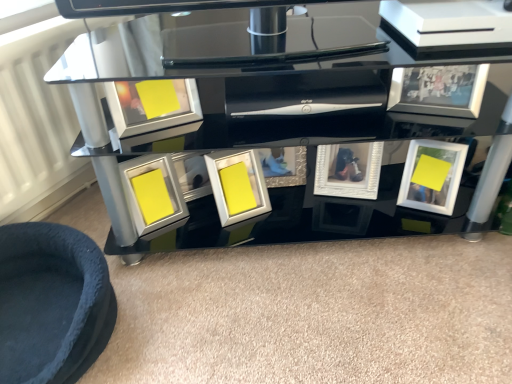
Question: Can you confirm if white textured frame at center, placed as the fourth picture frame when sorted from left to right, is taller than velvet blue pet bed at lower left?

Choices:
 (A) no
 (B) yes

Answer: (B)

Question: Is white textured frame at center, placed as the fourth picture frame when sorted from left to right, smaller than velvet blue pet bed at lower left?

Choices:
 (A) no
 (B) yes

Answer: (B)

Question: From the image's perspective, would you say white textured frame at center, acting as the 3th picture frame starting from the right, is shown under velvet blue pet bed at lower left?

Choices:
 (A) no
 (B) yes

Answer: (A)

Question: Is white textured frame at center, acting as the 3th picture frame starting from the right, outside of velvet blue pet bed at lower left?

Choices:
 (A) no
 (B) yes

Answer: (B)

Question: Could you tell me if white textured frame at center, acting as the 3th picture frame starting from the right, is turned towards velvet blue pet bed at lower left?

Choices:
 (A) yes
 (B) no

Answer: (B)

Question: From a real-world perspective, is matte silver picture frame at upper left, which appears as the 2th picture frame when viewed from the left, above or below black glass table at center?

Choices:
 (A) below
 (B) above

Answer: (B)

Question: In terms of width, does matte silver picture frame at upper left, the fifth picture frame positioned from the right, look wider or thinner when compared to black glass table at center?

Choices:
 (A) wide
 (B) thin

Answer: (B)

Question: From the image's perspective, is matte silver picture frame at upper left, the fifth picture frame positioned from the right, located above or below black glass table at center?

Choices:
 (A) below
 (B) above

Answer: (B)

Question: Visually, is matte silver picture frame at upper left, the fifth picture frame positioned from the right, positioned to the left or to the right of black glass table at center?

Choices:
 (A) right
 (B) left

Answer: (B)

Question: From a real-world perspective, is white textured frame at center, placed as the fourth picture frame when sorted from left to right, positioned above or below black glass table at center?

Choices:
 (A) above
 (B) below

Answer: (B)

Question: In terms of width, does white textured frame at center, acting as the 3th picture frame starting from the right, look wider or thinner when compared to black glass table at center?

Choices:
 (A) wide
 (B) thin

Answer: (B)

Question: In the image, is white textured frame at center, placed as the fourth picture frame when sorted from left to right, on the left side or the right side of black glass table at center?

Choices:
 (A) left
 (B) right

Answer: (B)

Question: Is point (356, 188) closer or farther from the camera than point (200, 61)?

Choices:
 (A) closer
 (B) farther

Answer: (B)

Question: In the image, is white textured frame at center, placed as the fourth picture frame when sorted from left to right, on the left side or the right side of velvet blue pet bed at lower left?

Choices:
 (A) left
 (B) right

Answer: (B)

Question: Is white textured frame at center, placed as the fourth picture frame when sorted from left to right, wider or thinner than velvet blue pet bed at lower left?

Choices:
 (A) thin
 (B) wide

Answer: (A)